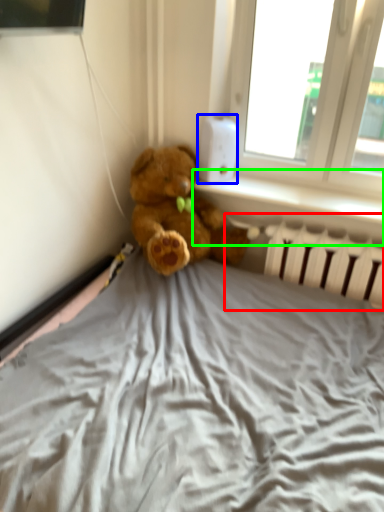
Question: Considering the real-world distances, which object is farthest from radiator (highlighted by a red box)? thermostat (highlighted by a blue box) or window sill (highlighted by a green box)?

Choices:
 (A) thermostat
 (B) window sill

Answer: (A)